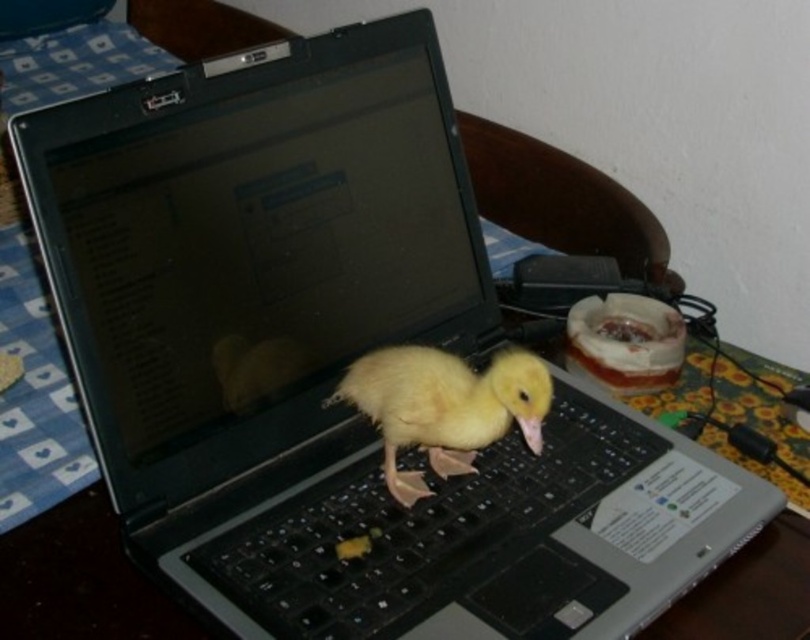
You are a photographer trying to capture a clear photo of the yellow downy duckling at center on the black plastic keyboard at center. Since the duckling is on the keyboard, will you need to adjust your focus to account for the keyboard being closer to you?

The black plastic keyboard at center is closer to the viewer than the yellow downy duckling at center. Therefore, to focus on the duckling, you need to adjust your focus beyond the keyboard since the duckling is farther away.

You are a software developer working from home and need to type an urgent email. The yellow downy duckling at center is blocking your black plastic keyboard at center. Can you type without moving the duckling?

The black plastic keyboard at center and yellow downy duckling at center are 2.87 inches apart, so you can type without moving the duckling since there is enough space between them.

From the picture: You are a photographer trying to capture a closeup of the yellow downy duckling at center on the black plastic keyboard at center. Since the duckling is small, you want to ensure it fits entirely within the frame. Based on their sizes, will the duckling fit horizontally on the keyboard?

The black plastic keyboard at center is wider than the yellow downy duckling at center, so the duckling will fit horizontally on the keyboard.